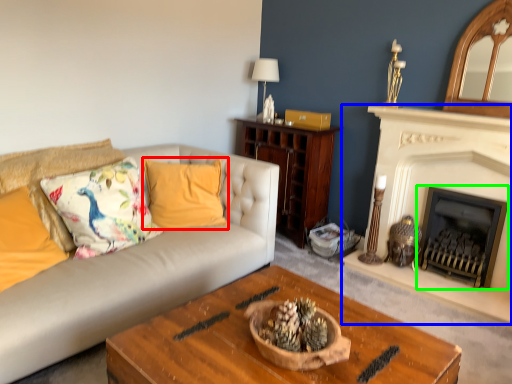
Question: Which object is positioned farthest from pillow (highlighted by a red box)? Select from fireplace (highlighted by a blue box) and fireplace (highlighted by a green box).

Choices:
 (A) fireplace
 (B) fireplace

Answer: (B)